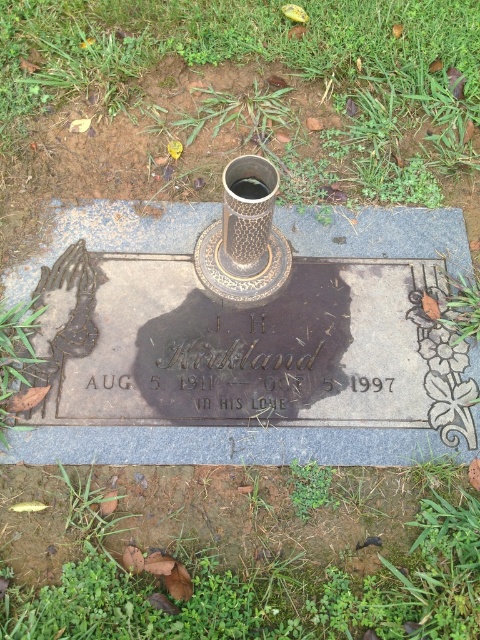
You are a landscape architect designing a new garden layout. You need to place a decorative stone between the green grass at center and the green grass at lower center. Can you fit the stone if it requires at least 1 meter of space between the two grass areas?

The distance between the green grass at center and green grass at lower center is 1.17 meters, which is more than the required 1 meter. Therefore, you can fit the decorative stone between them.

From the picture: You are a groundskeeper tasked with mowing the lawn in the cemetery. You notice two patches of green grass at center and green grass at lower center. Which patch requires immediate attention due to its height?

The green grass at center requires immediate attention because it is much taller than the green grass at lower center.

You are standing in a cemetery and see two patches of green grass at center and green grass at lower center. Which one is closer to you?

The green grass at lower center is behind green grass at center, so the green grass at center is closer to you.